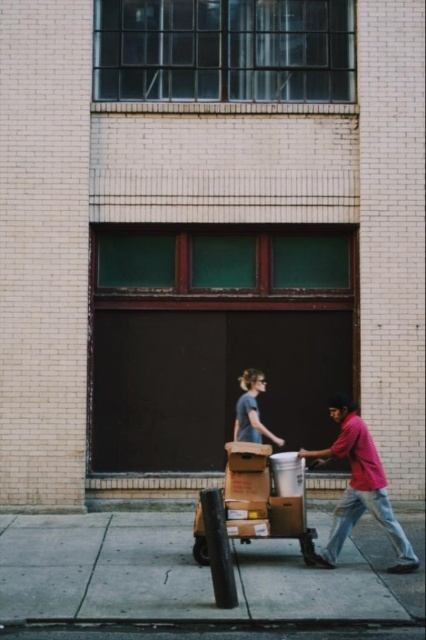
You are a delivery person standing at the point marked by the coordinates point (184, 572). You need to deliver a package to the beige brick building with the dark brown garage door. Which direction should you walk to reach the building?

The point (184, 572) corresponds to the gray concrete sidewalk at lower center. Since the beige brick building with the dark brown garage door is the central feature in the scene, you should walk towards the center of the image to reach the building.